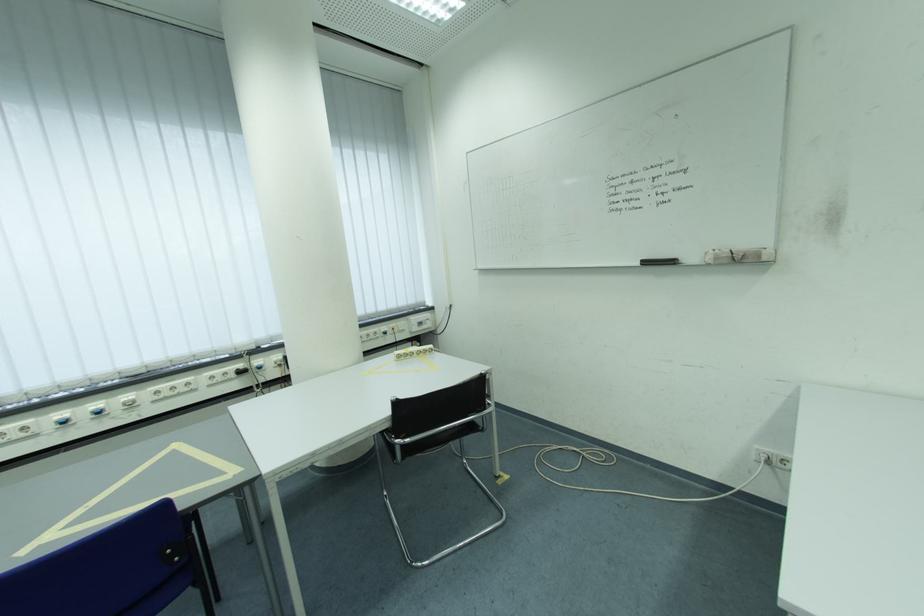
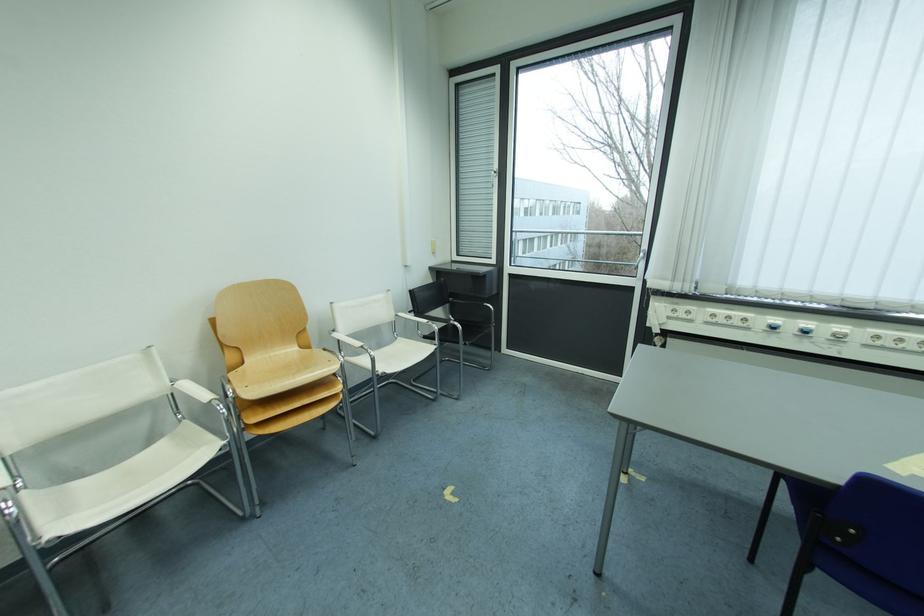
Question: I am providing you with two images of the same scene from different viewpoints. Please identify which objects are invisible in image2.

Choices:
 (A) chair armrest
 (B) blind control chain
 (C) power outlet socket
 (D) none of these

Answer: (D)